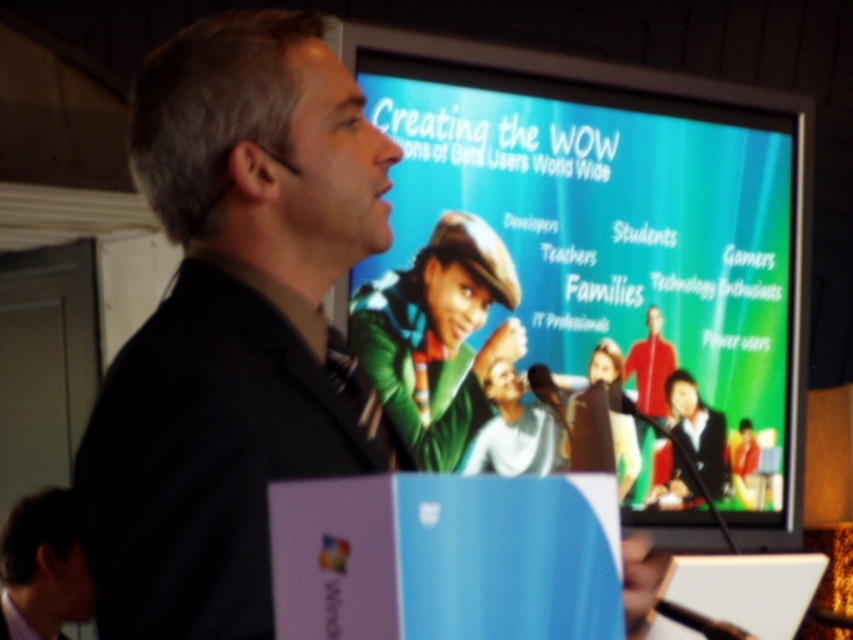
You are a stagehand who needs to place a 24 inch wide banner between the black matte suit at center and the white plastic laptop at center. Can you fit the banner between them?

The distance between the black matte suit at center and the white plastic laptop at center is 36.22 inches. Since the banner is 24 inches wide, it can fit between them as there is enough space.

You are an event organizer who needs to arrange seating for the speaker and his assistant. The speaker is wearing the black matte suit at center, and the assistant is wearing the matte black shirt at lower left. Based on their positions in the image, which one should sit closer to the front of the stage?

The black matte suit at center should sit closer to the front of the stage because they are positioned above the matte black shirt at lower left in the image, indicating they are at a higher elevation or closer to the front.